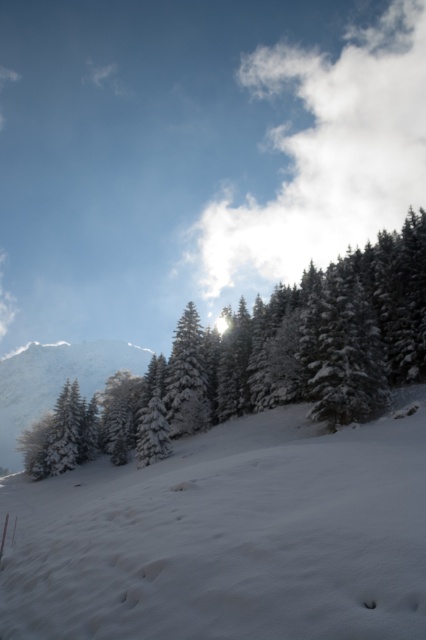
Does white snow at lower left come behind white frosty mountain at left?

No, it is in front of white frosty mountain at left.

Is point (100, 579) farther from camera compared to point (66, 349)?

No, (100, 579) is closer to viewer.

Where is `white snow at lower left`? The image size is (426, 640). white snow at lower left is located at coordinates (229, 538).

At what (x,y) coordinates should I click in order to perform the action: click on white snow at lower left. Please return your answer as a coordinate pair (x, y). Image resolution: width=426 pixels, height=640 pixels. Looking at the image, I should click on (229, 538).

Does green matte evergreen tree at upper center have a greater height compared to white frosty mountain at left?

Correct, green matte evergreen tree at upper center is much taller as white frosty mountain at left.

Based on the photo, which is more to the right, green matte evergreen tree at upper center or white frosty mountain at left?

green matte evergreen tree at upper center is more to the right.

Measure the distance between point (394, 337) and camera.

The distance of point (394, 337) from camera is 179.33 feet.

Image resolution: width=426 pixels, height=640 pixels. Identify the location of green matte evergreen tree at upper center. (287, 349).

The height and width of the screenshot is (640, 426). Find the location of `white snow at lower left`. white snow at lower left is located at coordinates (229, 538).